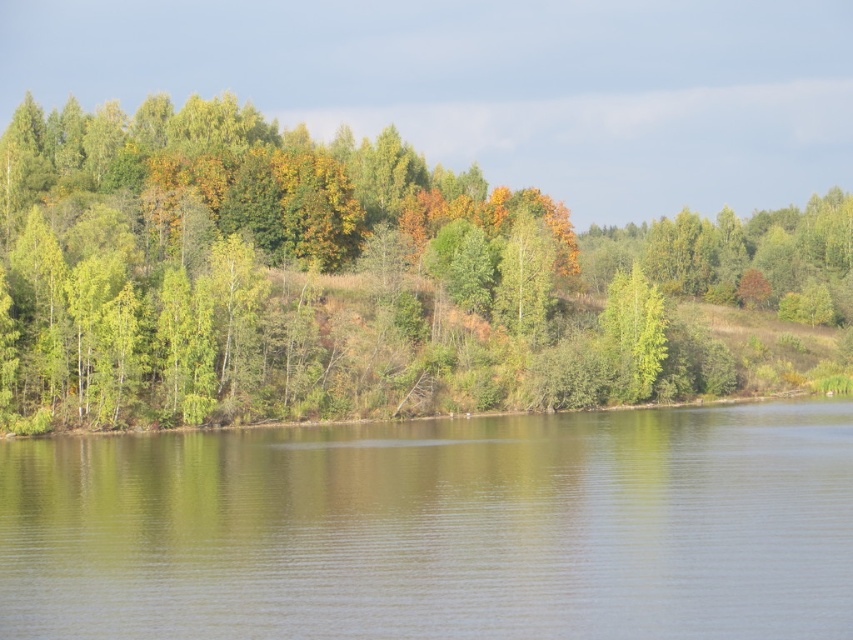
You are standing at the lakeside and want to take a photo of both the green leafy trees at center and the green matte tree at center. Which tree should you focus on first to ensure both are in clear view?

You should focus on the green leafy trees at center first since it is closer to you than the green matte tree at center, ensuring both are in clear view by adjusting the focus accordingly.

You are standing at the point labeled point (349, 278) in the image. What type of trees are directly in front of you?

The point (349, 278) corresponds to green leafy trees at center, so the trees directly in front of you are green leafy trees at center.

You are standing on the bank of the lake and see the green reflective water at center and the green matte tree at center. Which object is taller from your perspective?

The green reflective water at center is not as tall as the green matte tree at center, so the green matte tree at center is taller.